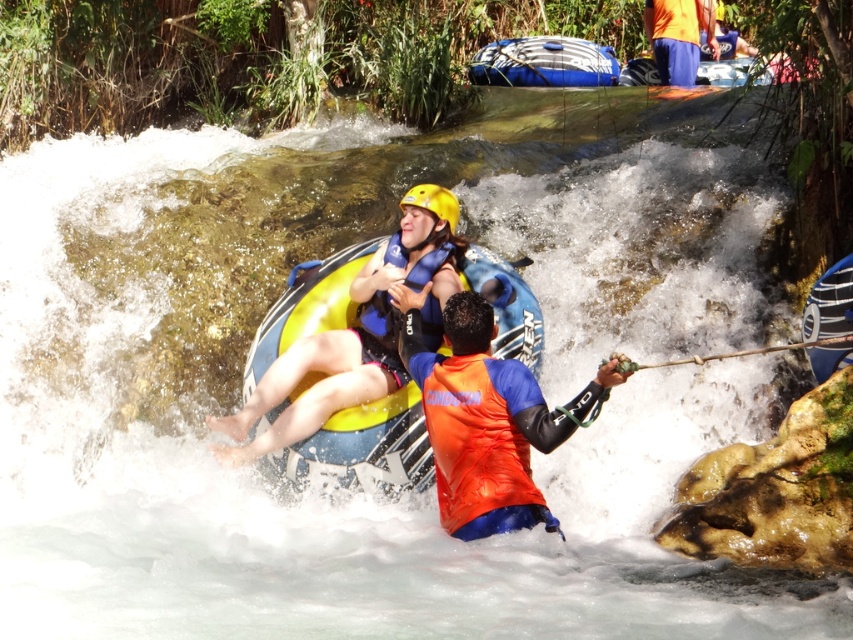
You are a safety inspector evaluating the rafting gear. You notice the orange waterproof vest at center and the wooden paddle at center. Which piece of equipment is bigger?

The orange waterproof vest at center is larger in size than the wooden paddle at center.